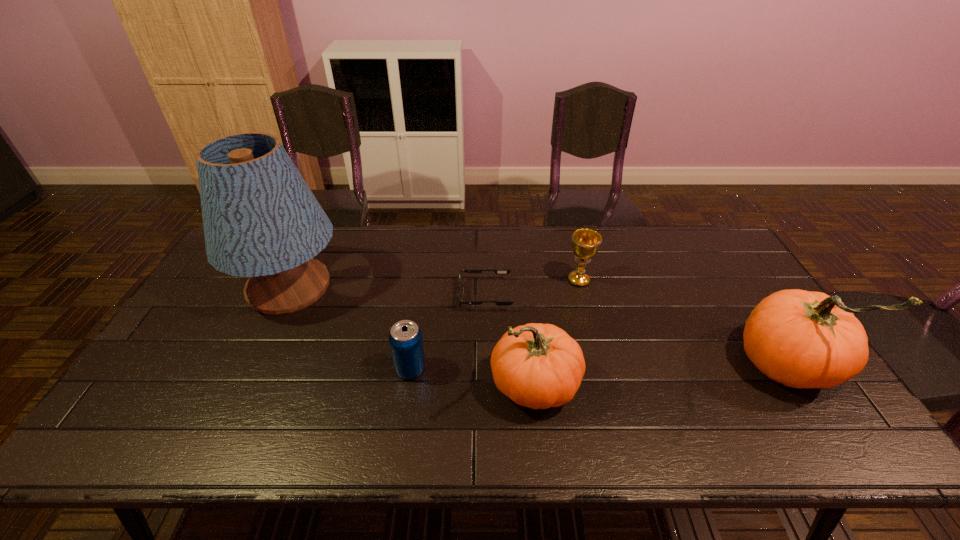
Find the location of a particular element. free region that satisfies the following two spatial constraints: 1. on the temples of the left pumpkin; 2. on the right side of the sunglasses is located at coordinates (487, 386).

Find the location of a particular element. Image resolution: width=960 pixels, height=540 pixels. free location that satisfies the following two spatial constraints: 1. on the front side of the chalice; 2. on the temples of the sunglasses is located at coordinates (583, 295).

This screenshot has width=960, height=540. Find the location of `free region that satisfies the following two spatial constraints: 1. on the back side of the fifth object from left to right; 2. on the left side of the lampshade`. free region that satisfies the following two spatial constraints: 1. on the back side of the fifth object from left to right; 2. on the left side of the lampshade is located at coordinates (293, 280).